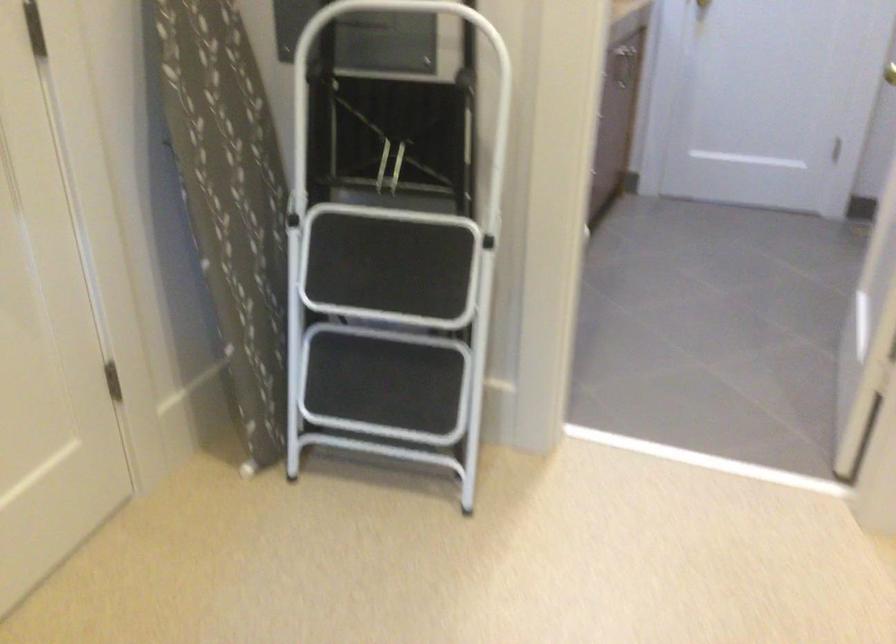
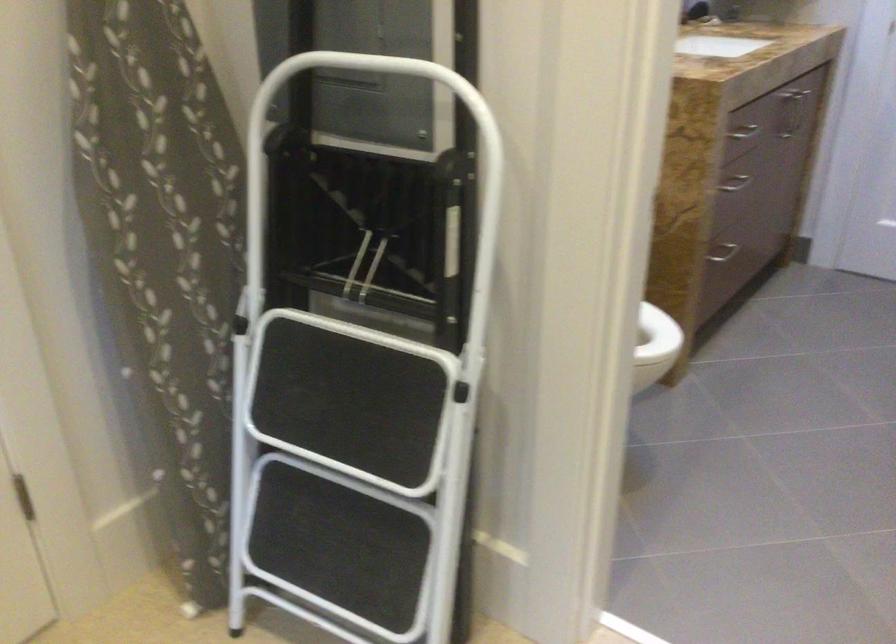
What movement of the cameraman would produce the second image?

The cameraman walked toward right, forward.